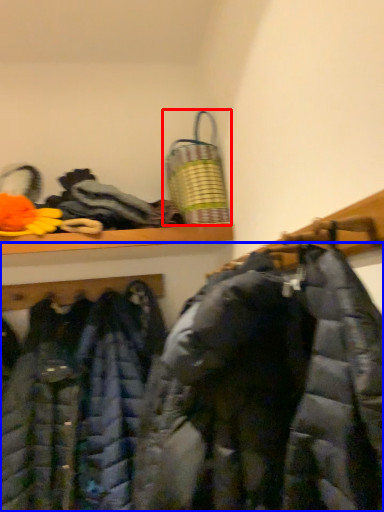
Question: Among these objects, which one is farthest to the camera, laundry basket (highlighted by a red box) or jacket (highlighted by a blue box)?

Choices:
 (A) laundry basket
 (B) jacket

Answer: (A)